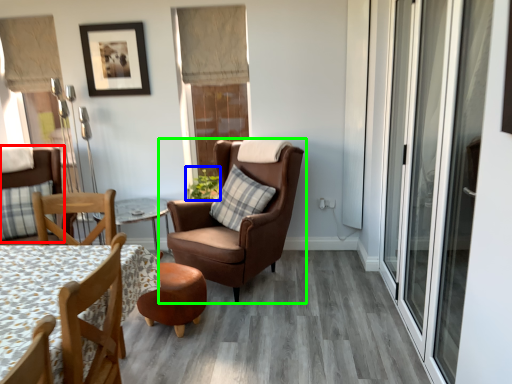
Question: Which is nearer to the chair (highlighted by a red box)? plant (highlighted by a blue box) or chair (highlighted by a green box).

Choices:
 (A) plant
 (B) chair

Answer: (A)